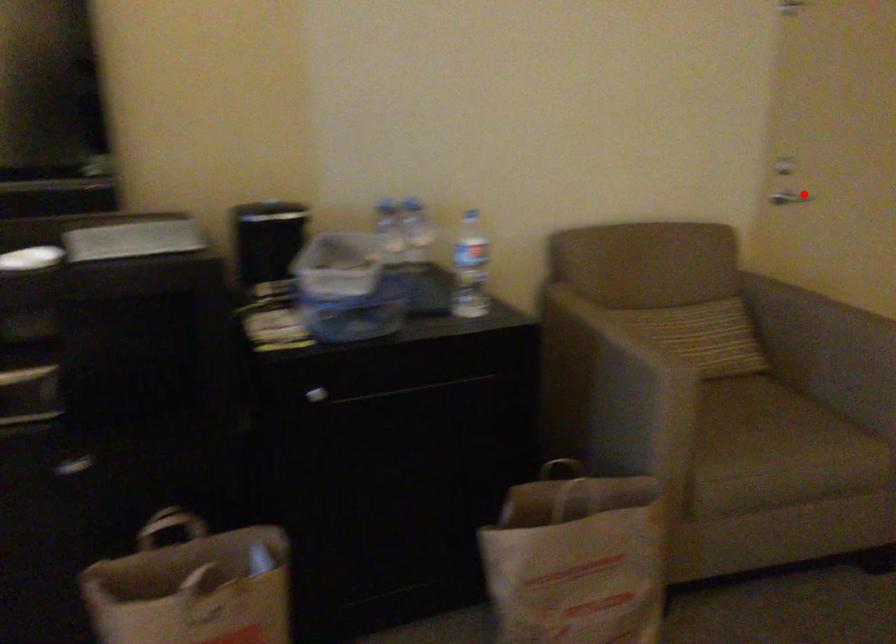
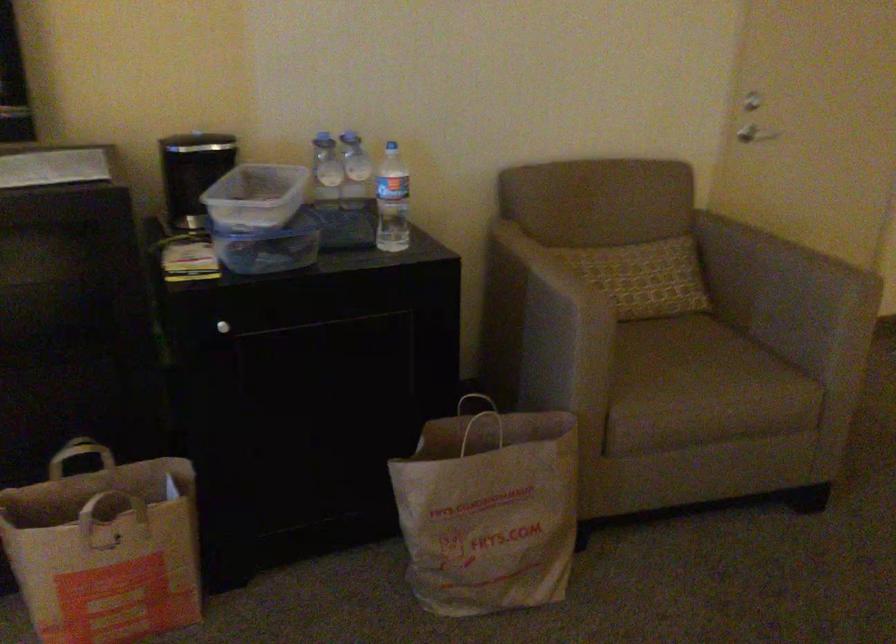
Where in the second image is the point corresponding to the highlighted location from the first image?

(760, 135)